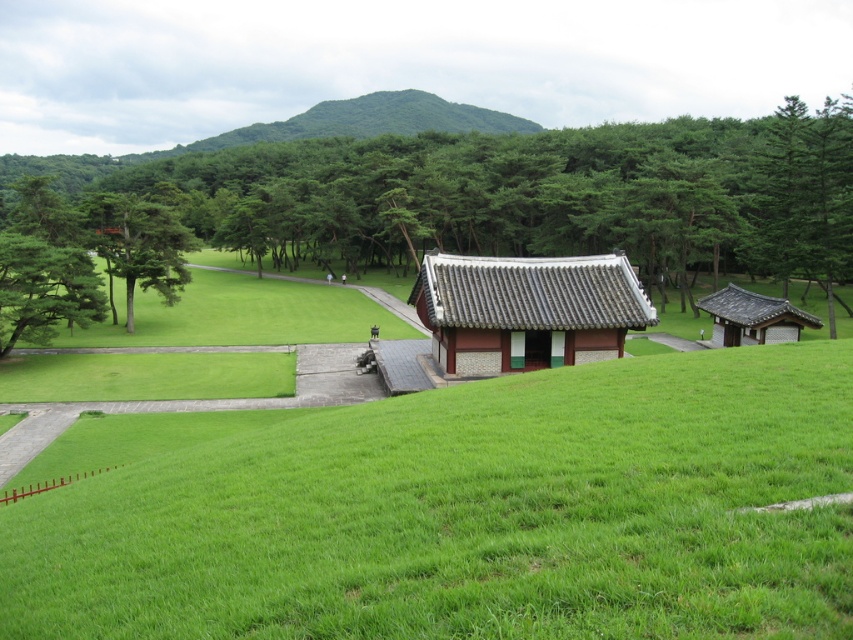
Does point (62, 273) come in front of point (697, 301)?

Yes, it is in front of point (697, 301).

At what (x,y) coordinates should I click in order to perform the action: click on green leafy tree at left. Please return your answer as a coordinate pair (x, y). The height and width of the screenshot is (640, 853). Looking at the image, I should click on (44, 289).

Is green grass at center bigger than matte gray tile hut at center?

Yes, green grass at center is bigger than matte gray tile hut at center.

Who is positioned more to the left, green grass at center or matte gray tile hut at center?

Positioned to the left is green grass at center.

This screenshot has height=640, width=853. Identify the location of green grass at center. (459, 509).

Does green leafy tree at center lie behind green textured tree at upper left?

No, green leafy tree at center is closer to the viewer.

From the picture: Which is above, green leafy tree at center or green textured tree at upper left?

green leafy tree at center

Is point (778, 198) positioned in front of point (131, 209)?

Yes, point (778, 198) is closer to viewer.

The width and height of the screenshot is (853, 640). What are the coordinates of `green leafy tree at center` in the screenshot? It's located at (508, 195).